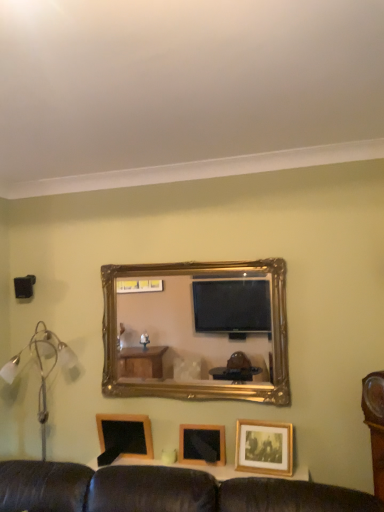
Question: From the image's perspective, is silver metallic floor lamp at left located beneath black plastic speaker at left?

Choices:
 (A) yes
 (B) no

Answer: (A)

Question: From a real-world perspective, is silver metallic floor lamp at left on black plastic speaker at left?

Choices:
 (A) yes
 (B) no

Answer: (B)

Question: Is silver metallic floor lamp at left at the right side of black plastic speaker at left?

Choices:
 (A) no
 (B) yes

Answer: (B)

Question: Is silver metallic floor lamp at left positioned behind black plastic speaker at left?

Choices:
 (A) no
 (B) yes

Answer: (A)

Question: Is silver metallic floor lamp at left thinner than black plastic speaker at left?

Choices:
 (A) no
 (B) yes

Answer: (A)

Question: In terms of width, does wooden picture frame at lower right, positioned as the 3th picture frame in left-to-right order, look wider or thinner when compared to wooden picture frame at center, arranged as the second picture frame when viewed from the left?

Choices:
 (A) thin
 (B) wide

Answer: (A)

Question: Is wooden picture frame at lower right, positioned as the 3th picture frame in left-to-right order, bigger or smaller than wooden picture frame at center, which appears as the 2th picture frame when viewed from the right?

Choices:
 (A) big
 (B) small

Answer: (A)

Question: Is point (251, 455) positioned closer to the camera than point (203, 459)?

Choices:
 (A) farther
 (B) closer

Answer: (B)

Question: Based on their positions, is wooden picture frame at lower right, positioned as the 3th picture frame in left-to-right order, located to the left or right of wooden picture frame at center, arranged as the second picture frame when viewed from the left?

Choices:
 (A) left
 (B) right

Answer: (B)

Question: Which is correct: gold/gilded mirror at center is inside wooden blackboard at lower left, which is the 3th picture frame from right to left, or outside of it?

Choices:
 (A) inside
 (B) outside

Answer: (B)

Question: Would you say gold/gilded mirror at center is to the left or to the right of wooden blackboard at lower left, which is the 3th picture frame from right to left, in the picture?

Choices:
 (A) left
 (B) right

Answer: (B)

Question: Looking at the image, does gold/gilded mirror at center seem bigger or smaller compared to wooden blackboard at lower left, which is counted as the 1th picture frame, starting from the left?

Choices:
 (A) small
 (B) big

Answer: (B)

Question: Is gold/gilded mirror at center taller or shorter than wooden blackboard at lower left, which is the 3th picture frame from right to left?

Choices:
 (A) tall
 (B) short

Answer: (A)

Question: In the image, is silver metallic floor lamp at left positioned in front of or behind wooden picture frame at center, which appears as the 2th picture frame when viewed from the right?

Choices:
 (A) front
 (B) behind

Answer: (A)

Question: Do you think silver metallic floor lamp at left is within wooden picture frame at center, which appears as the 2th picture frame when viewed from the right, or outside of it?

Choices:
 (A) outside
 (B) inside

Answer: (A)